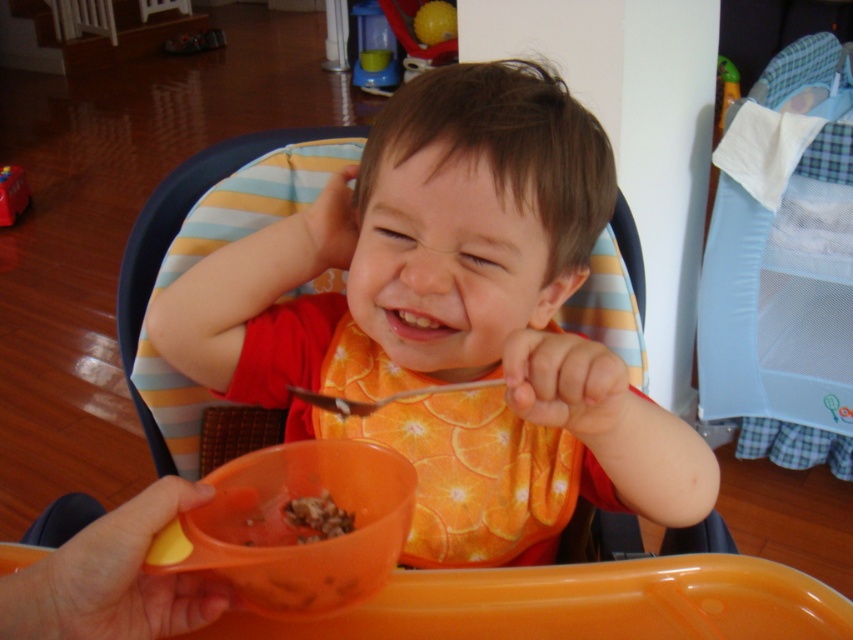
The child is sitting in a high chair and has an orange plastic bowl at lower center and brown crumbly food at center in front of them. Which object is positioned higher?

The orange plastic bowl at lower center is positioned higher than the brown crumbly food at center.

The child is trying to decide whether to eat the brown crumbly food at center or use the metallic silver spoon at upper center to get more food. Which item takes up more space on the table?

The metallic silver spoon at upper center takes up more space than the brown crumbly food at center because the brown crumbly food at center occupies less space than the spoon.

Consider the image. You are a photographer taking a picture of the child in the high chair. You need to focus on two points in the scene. The first point is at coordinates point (331,532) and the second point is at coordinates point (427,385). Which point should you focus on first to ensure the child is sharp in the photo?

You should focus on point (331,532) first because it is closer to the camera than point (427,385), ensuring the child is sharp in the photo.